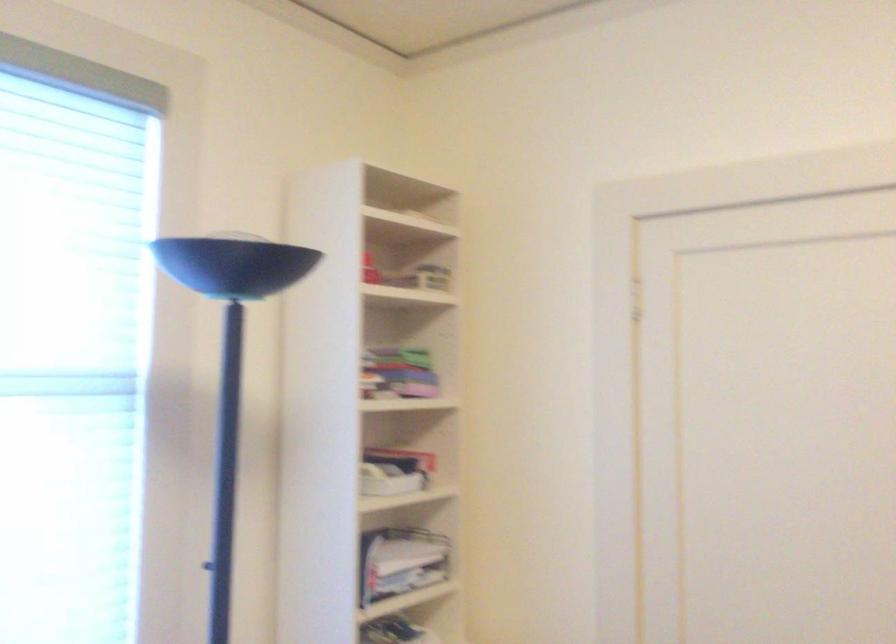
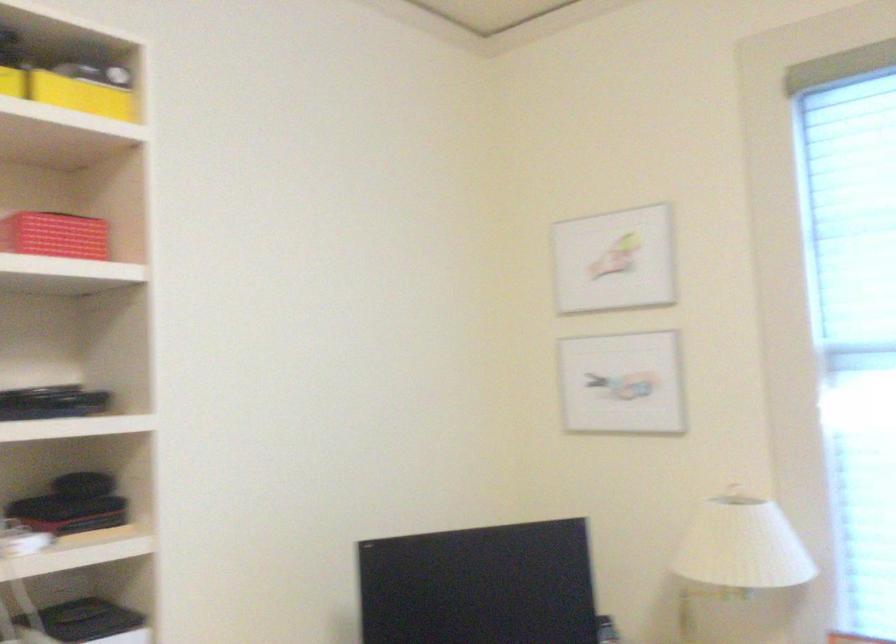
Question: How did the camera likely rotate?

Choices:
 (A) Left
 (B) Right
 (C) Up
 (D) Down

Answer: (A)